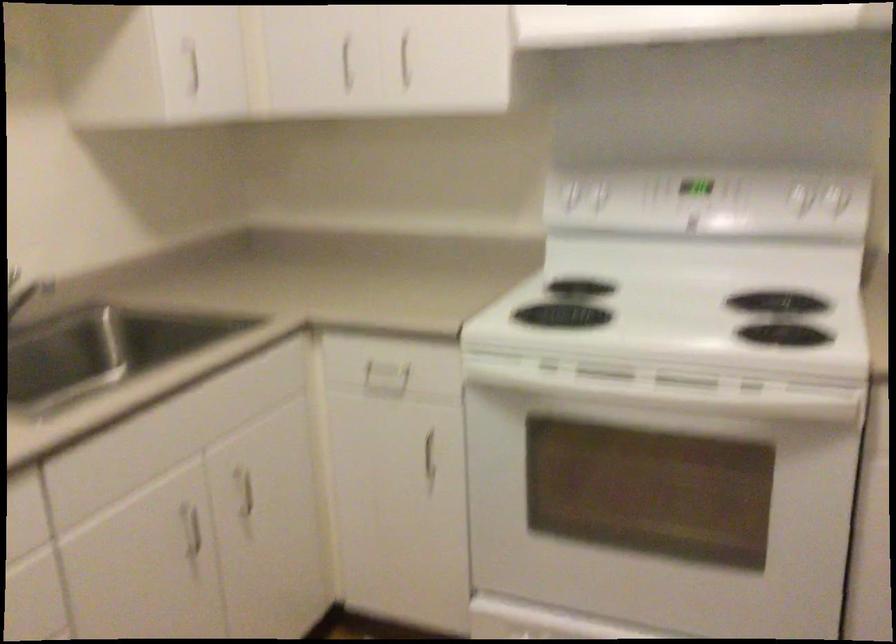
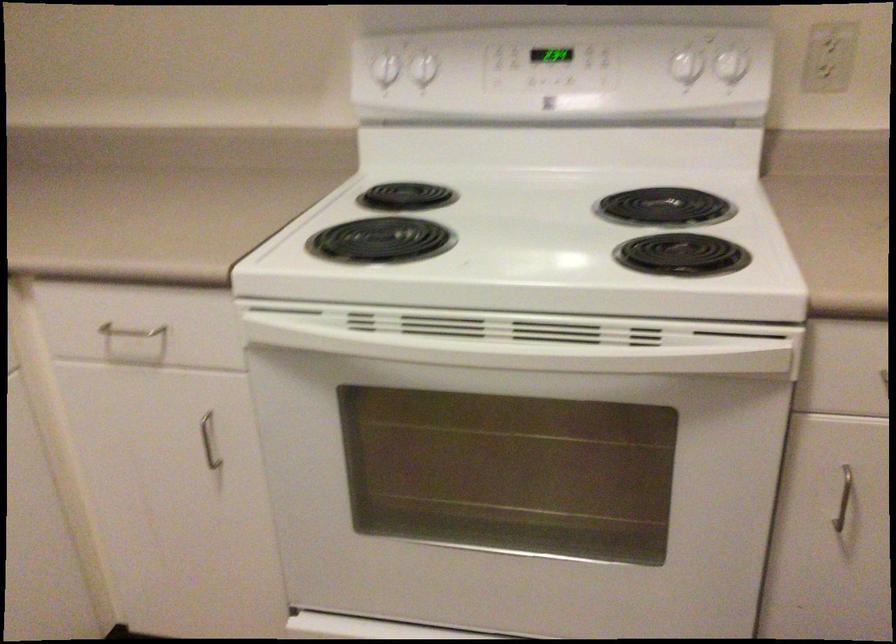
Locate, in the second image, the point that corresponds to pixel 582 285 in the first image.

(407, 196)